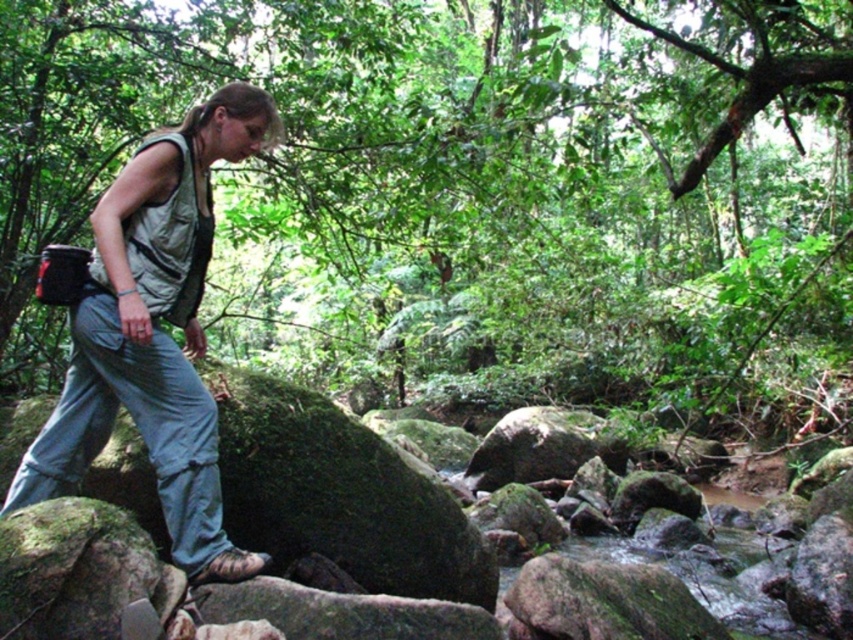
Question: Which of the following is the farthest from the observer?

Choices:
 (A) (155, 362)
 (B) (341, 192)

Answer: (B)

Question: Considering the relative positions of green mossy rocks at center and light gray fabric vest at left in the image provided, where is green mossy rocks at center located with respect to light gray fabric vest at left?

Choices:
 (A) left
 (B) right

Answer: (B)

Question: Is green mossy rocks at center further to camera compared to light gray fabric vest at left?

Choices:
 (A) yes
 (B) no

Answer: (A)

Question: Is green mossy rocks at center above light gray fabric vest at left?

Choices:
 (A) yes
 (B) no

Answer: (A)